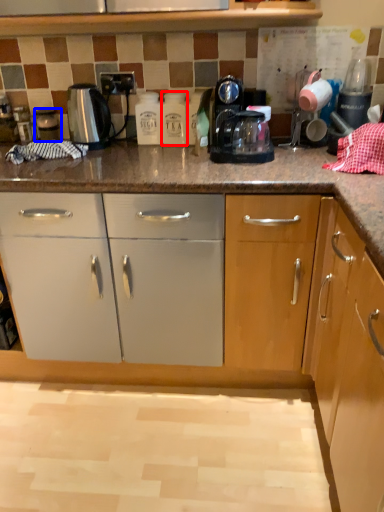
Question: Which point is closer to the camera, bottle (highlighted by a red box) or appliance (highlighted by a blue box)?

Choices:
 (A) bottle
 (B) appliance

Answer: (A)